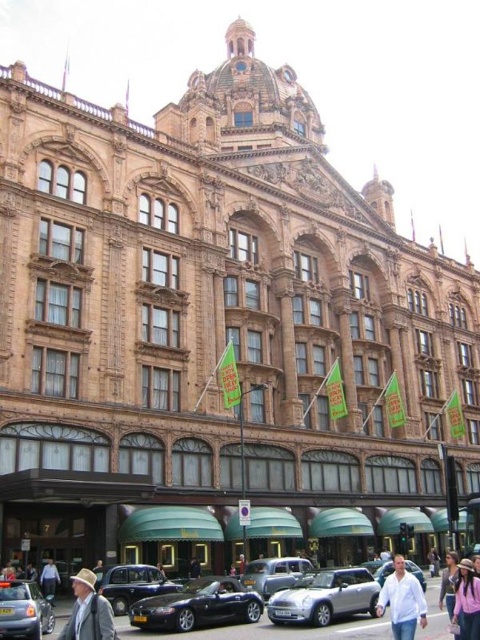
From the picture: How distant is shiny black convertible at lower center from silver metallic car at center?

A distance of 3.89 meters exists between shiny black convertible at lower center and silver metallic car at center.

Who is more distant from viewer, [177,625] or [288,595]?

The point [288,595] is behind.

Is point (223, 593) in front of point (352, 592)?

That is True.

Locate an element on the screen. The width and height of the screenshot is (480, 640). shiny black convertible at lower center is located at coordinates (197, 605).

Does matte silver car at lower left have a lesser width compared to blue denim jeans at lower left?

No, matte silver car at lower left is not thinner than blue denim jeans at lower left.

Who is taller, matte silver car at lower left or blue denim jeans at lower left?

Standing taller between the two is matte silver car at lower left.

Between point (35, 604) and point (56, 579), which one is positioned behind?

The point (56, 579) is more distant.

What are the coordinates of `matte silver car at lower left` in the screenshot? It's located at (24, 611).

Does shiny black convertible at lower center come behind light brown leather hat at lower left?

Yes, shiny black convertible at lower center is behind light brown leather hat at lower left.

Looking at this image, can you confirm if shiny black convertible at lower center is positioned above light brown leather hat at lower left?

Actually, shiny black convertible at lower center is below light brown leather hat at lower left.

Between point (252, 616) and point (84, 604), which one is positioned in front?

Point (84, 604) is in front.

Locate an element on the screen. The width and height of the screenshot is (480, 640). shiny black convertible at lower center is located at coordinates (197, 605).